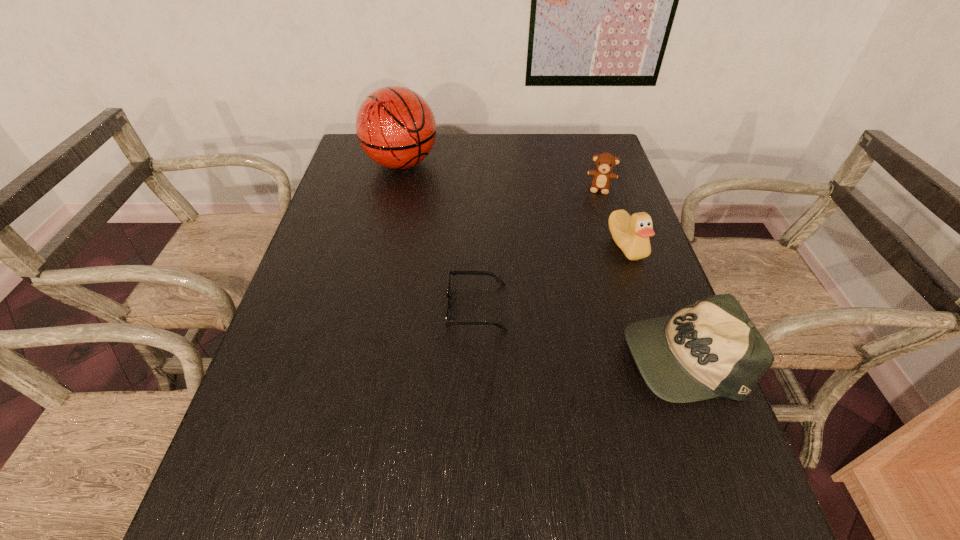
The height and width of the screenshot is (540, 960). What are the coordinates of `the fourth object from right to left` in the screenshot? It's located at (448, 305).

Locate an element on the screen. The height and width of the screenshot is (540, 960). the shortest object is located at coordinates (448, 305).

This screenshot has width=960, height=540. What are the coordinates of `baseball cap` in the screenshot? It's located at (711, 348).

Locate an element on the screen. The width and height of the screenshot is (960, 540). basketball is located at coordinates (395, 126).

Identify the location of the leftmost object. This screenshot has width=960, height=540. (395, 126).

You are a GUI agent. You are given a task and a screenshot of the screen. Output one action in this format:
    pyautogui.click(x=<x>, y=<y>)
    Task: Click on the teddy bear
    
    Given the screenshot: What is the action you would take?
    pyautogui.click(x=605, y=162)

The height and width of the screenshot is (540, 960). Find the location of `duck`. duck is located at coordinates (631, 233).

You are a GUI agent. You are given a task and a screenshot of the screen. Output one action in this format:
    pyautogui.click(x=<x>, y=<y>)
    Task: Click on the free space located on the front-facing side of the fourth object from right to left
    
    Given the screenshot: What is the action you would take?
    pyautogui.click(x=351, y=307)

Identify the location of vacant point located on the front-facing side of the fourth object from right to left. The height and width of the screenshot is (540, 960). (412, 307).

Locate an element on the screen. vacant region located 0.200m on the front-facing side of the fourth object from right to left is located at coordinates [360, 307].